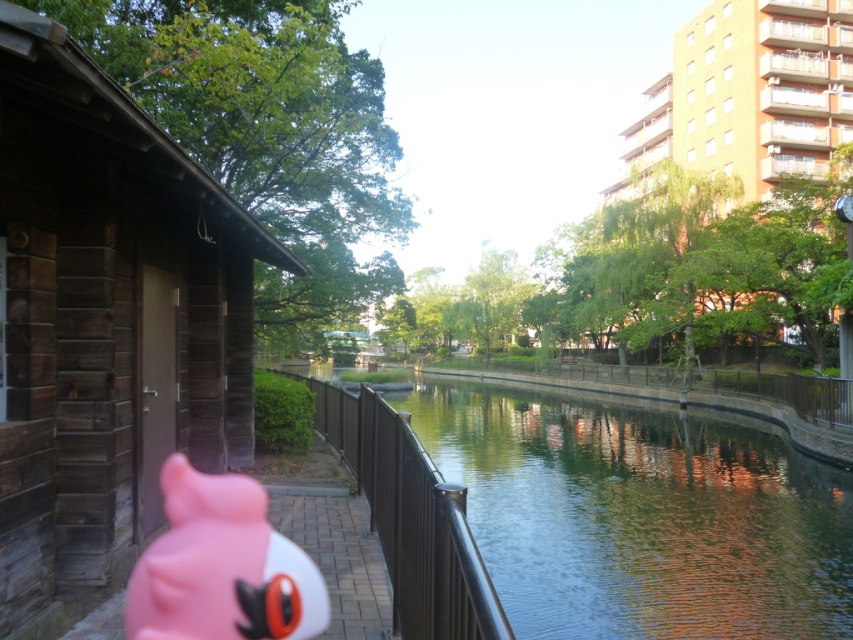
You are standing at the edge of the canal and want to reach a point that is closer to you. Which point should you head towards, point [737,545] or point [463,540]?

You should head towards point [463,540] because it is closer to you than point [737,545].